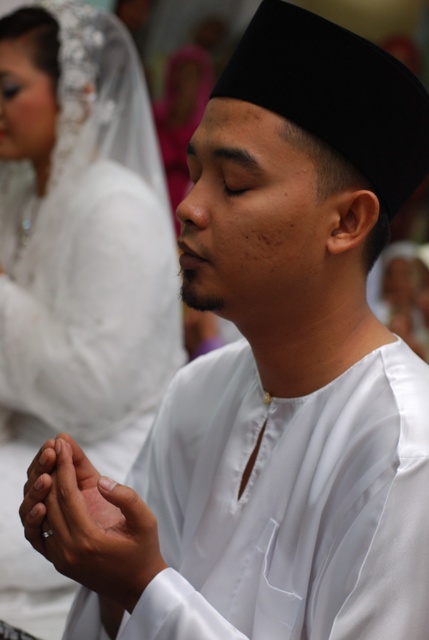
You are an event planner setting up a photo shoot. You need to place a spotlight at the exact center of the image to highlight the main subject. However, you also want to ensure that the white satin veil at upper left remains visible but not overly highlighted. Given the coordinates provided, where should you position the spotlight to achieve this?

The white satin veil at upper left is located at coordinates point (75, 268). To ensure it remains visible but not overly highlighted, position the spotlight at the center of the image, which is point (214, 320). This placement will keep the main subject illuminated while the veil stays in a less intense area of the light.

Based on the photo, you are a photographer trying to capture the perfect shot of the ceremony. You notice the white satin veil at upper left and the white satin hands at center. Which object is positioned more to the left in the image?

The white satin veil at upper left is positioned to the left of the white satin hands at center, so it is more to the left.